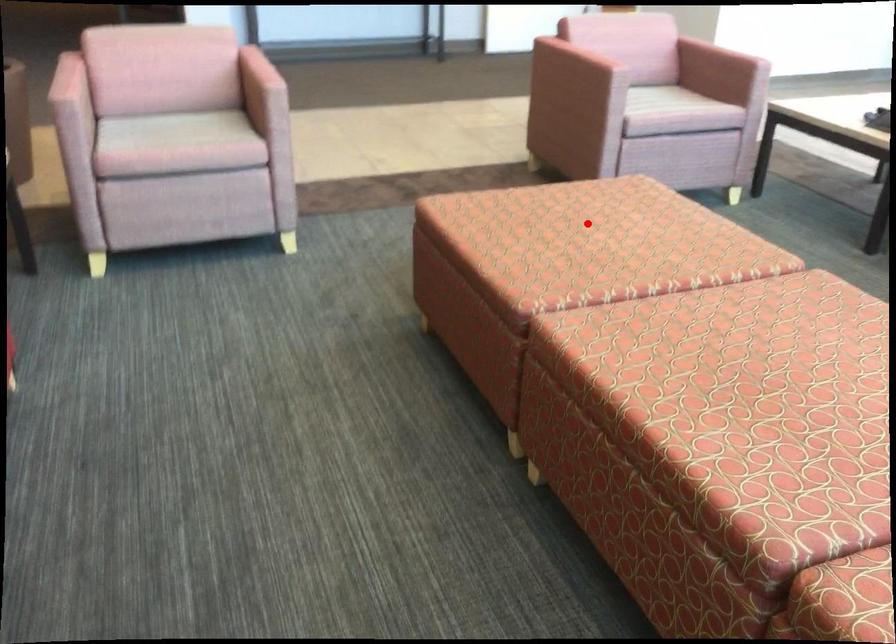
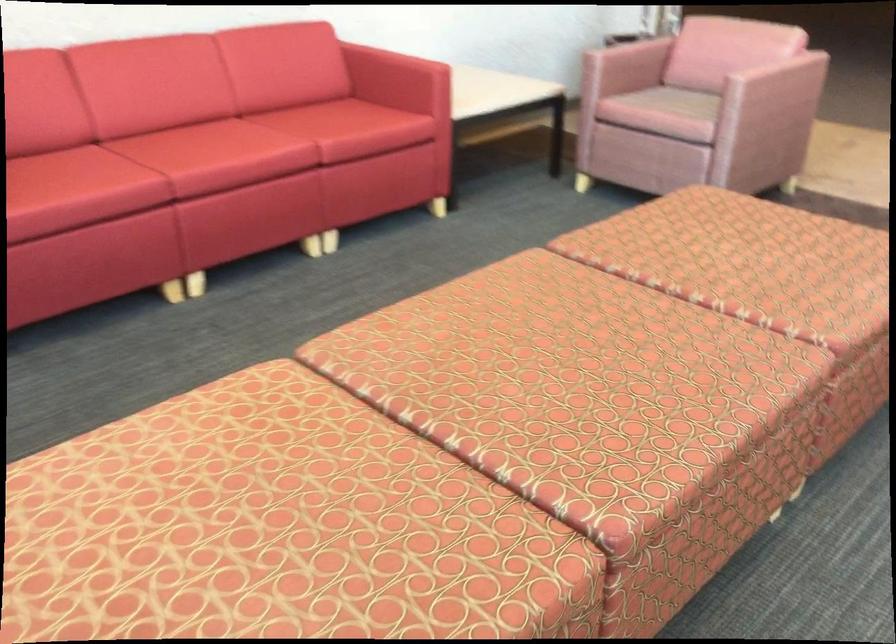
In the second image, find the point that corresponds to the highlighted location in the first image.

(762, 245)